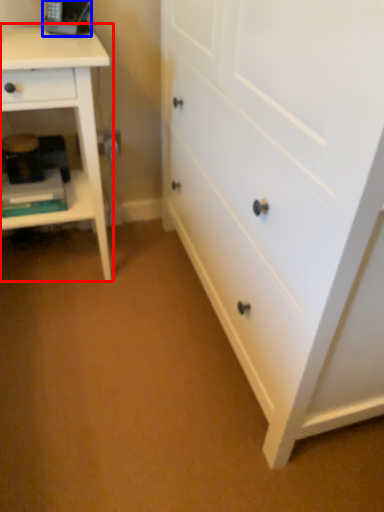
Question: Which point is closer to the camera, nightstand (highlighted by a red box) or equipment (highlighted by a blue box)?

Choices:
 (A) nightstand
 (B) equipment

Answer: (A)